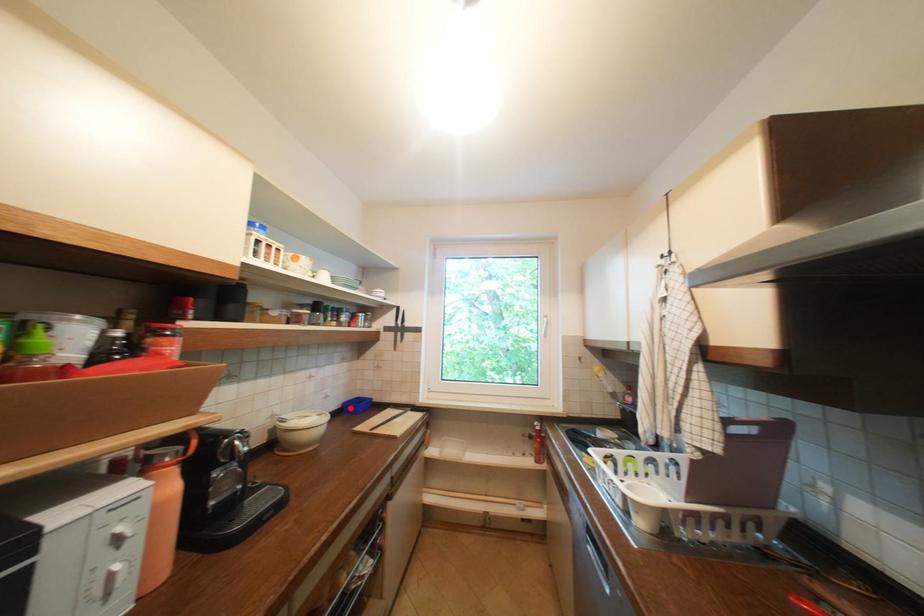
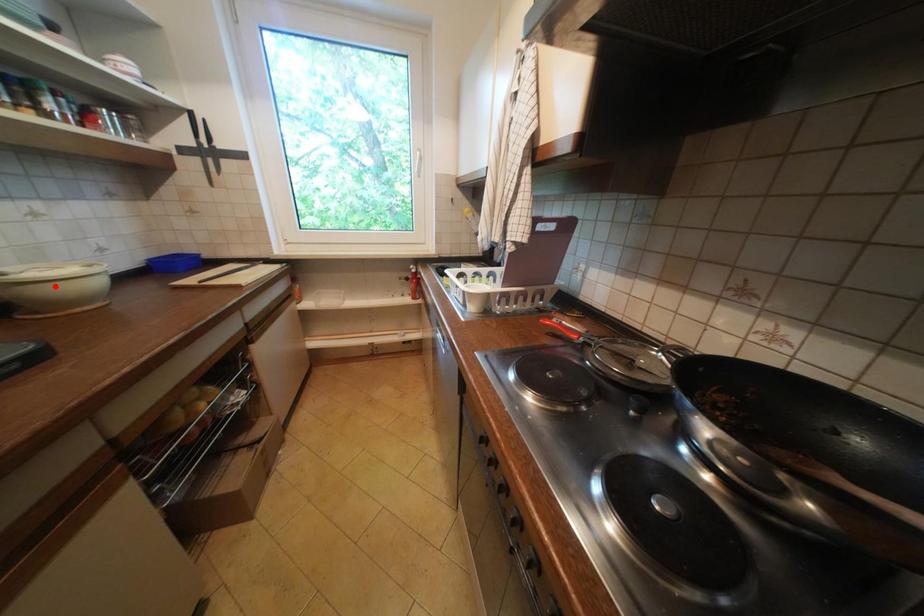
I am providing you with two images of the same scene from different viewpoints. A red point is marked on the first image and another point is marked on the second image. Does the point marked in image1 correspond to the same location as the one in image2?

No